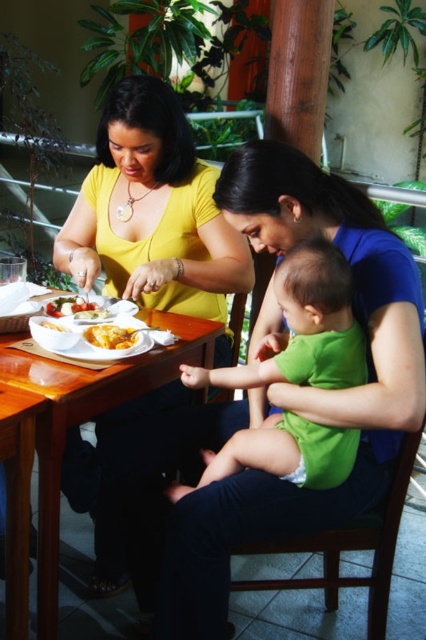
Consider the image. You are a waiter at the restaurant. You need to deliver a drink to the woman wearing the yellow matte shirt at upper left. However, there is a yellow cheesy pasta at table center in the way. Can you place the drink on the table without it falling off?

The yellow matte shirt at upper left is positioned under the yellow cheesy pasta at table center, so placing the drink near the pasta might cause it to tip over. Instead, place the drink on the side of the table away from the pasta to ensure stability.

You are a food delivery person who needs to deliver a dessert to the table. The dessert must be placed on the table. Which object should you place it on, the yellow cheesy pasta at table center or the white matte bowl at table center?

The dessert should be placed on the white matte bowl at table center because the yellow cheesy pasta at table center is closer to the viewer, meaning the bowl is likely further back and more appropriate for placing new items.

You are a waiter at the restaurant and need to serve two more dishes to the table. The table has limited space. Which object, the yellow cheesy pasta at table center or the white matte bowl at table center, should you move to make more space?

The yellow cheesy pasta at table center is smaller than the white matte bowl at table center, so moving the yellow cheesy pasta at table center would free up more space.